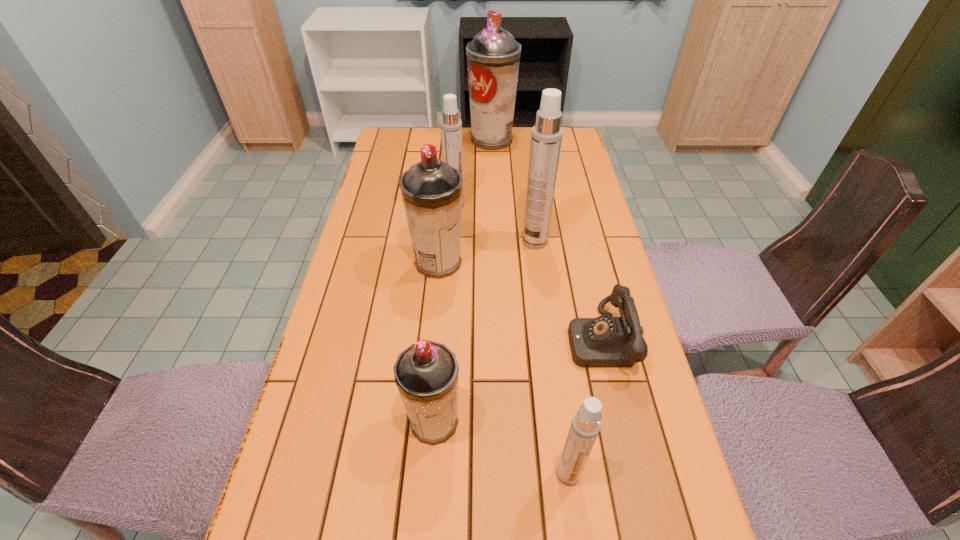
Find the location of a particular element. This screenshot has height=540, width=960. vacant point located between the farthest object and the leftmost white aerosol can is located at coordinates (473, 172).

The image size is (960, 540). I want to click on free space between the farthest aerosol can and the farthest white aerosol can, so click(x=473, y=172).

Locate an element on the screen. The width and height of the screenshot is (960, 540). free space between the telephone and the biggest white aerosol can is located at coordinates (567, 291).

At what (x,y) coordinates should I click in order to perform the action: click on free space between the sixth nearest object and the sixth farthest object. Please return your answer as a coordinate pair (x, y). Looking at the image, I should click on (444, 314).

Locate an element on the screen. Image resolution: width=960 pixels, height=540 pixels. vacant space that's between the second nearest object and the second farthest object is located at coordinates (444, 314).

The image size is (960, 540). Identify the location of the fourth closest object to the farthest white aerosol can. click(x=606, y=341).

Identify which object is the second closest to the farthest white aerosol can. Please provide its 2D coordinates. Your answer should be formatted as a tuple, i.e. [(x, y)], where the tuple contains the x and y coordinates of a point satisfying the conditions above.

[(546, 139)]

Choose which aerosol can is the third nearest neighbor to the fifth farthest aerosol can. Please provide its 2D coordinates. Your answer should be formatted as a tuple, i.e. [(x, y)], where the tuple contains the x and y coordinates of a point satisfying the conditions above.

[(546, 139)]

Choose which aerosol can is the fourth nearest neighbor to the smallest white aerosol can. Please provide its 2D coordinates. Your answer should be formatted as a tuple, i.e. [(x, y)], where the tuple contains the x and y coordinates of a point satisfying the conditions above.

[(451, 126)]

Identify the location of the closest gray aerosol can to the second nearest gray aerosol can. The height and width of the screenshot is (540, 960). (426, 373).